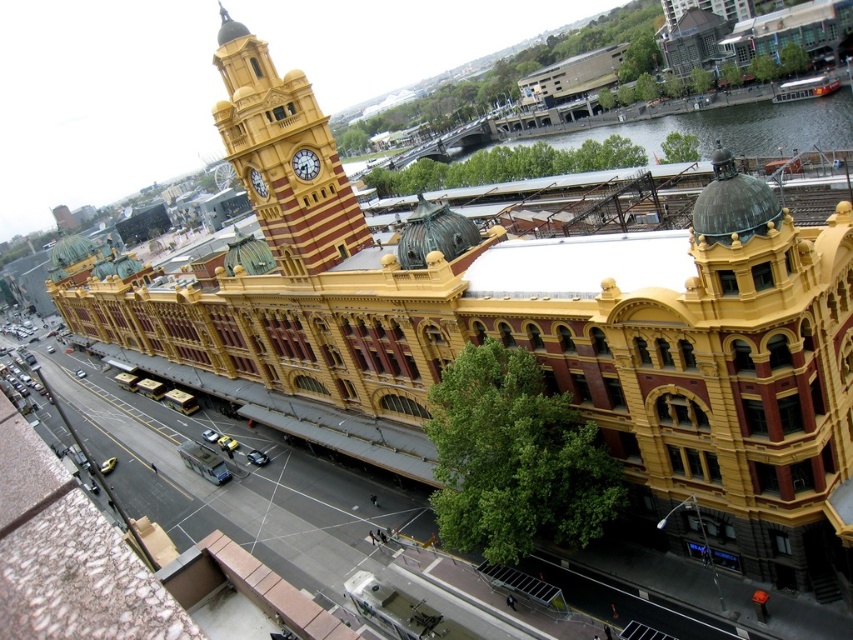
Between golden textured clock tower at upper left and gold metallic clock at upper center, which one appears on the left side from the viewer's perspective?

From the viewer's perspective, gold metallic clock at upper center appears more on the left side.

Is point (323, 150) positioned in front of point (252, 180)?

Yes, point (323, 150) is in front of point (252, 180).

Locate an element on the screen. This screenshot has height=640, width=853. golden textured clock tower at upper left is located at coordinates (283, 156).

Which of these two, gold metallic clock at center or gold metallic clock at upper center, stands shorter?

gold metallic clock at center is shorter.

Does gold metallic clock at center appear on the left side of gold metallic clock at upper center?

No, gold metallic clock at center is not to the left of gold metallic clock at upper center.

Between point (310, 177) and point (259, 189), which one is positioned behind?

The point (259, 189) is more distant.

Locate an element on the screen. gold metallic clock at center is located at coordinates (305, 163).

Is green water at upper right positioned behind gold metallic clock at upper center?

Yes, it is.

Who is positioned more to the right, green water at upper right or gold metallic clock at upper center?

From the viewer's perspective, green water at upper right appears more on the right side.

Where is `green water at upper right`? The width and height of the screenshot is (853, 640). green water at upper right is located at coordinates (720, 125).